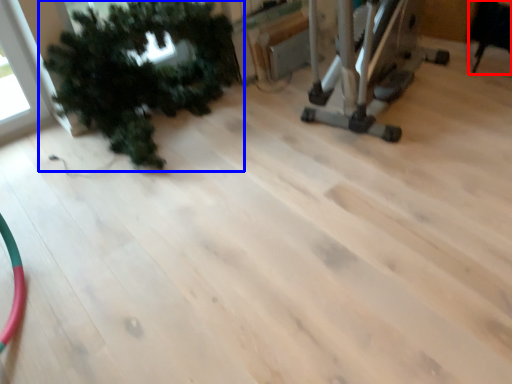
Question: Which object appears closest to the camera in this image, chair (highlighted by a red box) or houseplant (highlighted by a blue box)?

Choices:
 (A) chair
 (B) houseplant

Answer: (B)